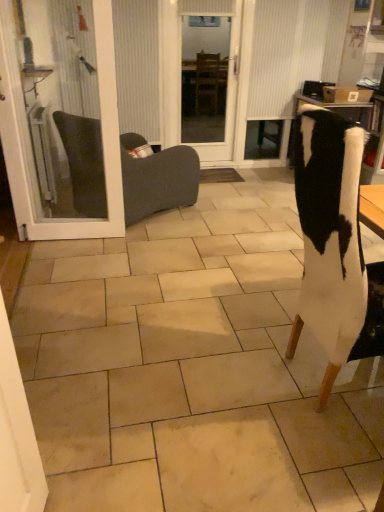
Describe the element at coordinates (275, 58) in the screenshot. I see `white textured curtain at upper center` at that location.

At what (x,y) coordinates should I click in order to perform the action: click on white textured curtain at upper center. Please return your answer as a coordinate pair (x, y). Looking at the image, I should click on (275, 58).

Can you confirm if white textured curtain at upper center is bigger than transparent glass door at center?

Yes.

Visually, is white textured curtain at upper center positioned to the left or to the right of transparent glass door at center?

white textured curtain at upper center is to the right of transparent glass door at center.

Is transparent glass door at center at the back of white textured curtain at upper center?

No, white textured curtain at upper center's orientation is not away from transparent glass door at center.

Is point (253, 86) in front of point (236, 17)?

No.

Are dark gray fabric chair at left, acting as the 1th chair starting from the left, and white textured curtain at upper center located far from each other?

That's right, there is a large distance between dark gray fabric chair at left, acting as the 1th chair starting from the left, and white textured curtain at upper center.

From the image's perspective, would you say dark gray fabric chair at left, which is the second chair in front-to-back order, is positioned over white textured curtain at upper center?

No, from the image's perspective, dark gray fabric chair at left, which is the second chair in front-to-back order, is not above white textured curtain at upper center.

From a real-world perspective, count 2nd chairs downward from the white textured curtain at upper center and point to it. Please provide its 2D coordinates.

[(157, 179)]

Based on their sizes in the image, would you say dark gray fabric chair at left, which is the second chair in front-to-back order, is bigger or smaller than white textured curtain at upper center?

In the image, dark gray fabric chair at left, which is the second chair in front-to-back order, appears to be larger than white textured curtain at upper center.

Is white fur chair at right, which is the second chair from back to front, facing towards white glass door at left?

No, white fur chair at right, which is the second chair from back to front, is not aimed at white glass door at left.

Is white fur chair at right, placed as the first chair when sorted from right to left, not near white glass door at left?

Yes, white fur chair at right, placed as the first chair when sorted from right to left, and white glass door at left are located far from each other.

Can you tell me how much white fur chair at right, placed as the second chair when sorted from left to right, and white glass door at left differ in facing direction?

The angle between the facing direction of white fur chair at right, placed as the second chair when sorted from left to right, and the facing direction of white glass door at left is 94.1 degrees.

From their relative heights in the image, would you say white fur chair at right, which is the second chair from back to front, is taller or shorter than white glass door at left?

white fur chair at right, which is the second chair from back to front, is shorter than white glass door at left.

From the image's perspective, is white textured curtain at upper center located beneath white fur chair at right, which is the second chair from back to front?

No, from the image's perspective, white textured curtain at upper center is not beneath white fur chair at right, which is the second chair from back to front.

Is white textured curtain at upper center positioned in front of white fur chair at right, which is counted as the first chair, starting from the front?

No, white textured curtain at upper center is further to the viewer.

Is white textured curtain at upper center positioned beyond the bounds of white fur chair at right, placed as the second chair when sorted from left to right?

Absolutely, white textured curtain at upper center is external to white fur chair at right, placed as the second chair when sorted from left to right.

How different are the orientations of white textured curtain at upper center and white fur chair at right, placed as the first chair when sorted from right to left, in degrees?

The facing directions of white textured curtain at upper center and white fur chair at right, placed as the first chair when sorted from right to left, are 89.4 degrees apart.

From the image's perspective, relative to dark gray fabric chair at left, which is the 1th chair in back-to-front order, is transparent glass door at center above or below?

Clearly, from the image's perspective, transparent glass door at center is above dark gray fabric chair at left, which is the 1th chair in back-to-front order.

From their relative heights in the image, would you say transparent glass door at center is taller or shorter than dark gray fabric chair at left, acting as the 1th chair starting from the left?

In the image, transparent glass door at center appears to be taller than dark gray fabric chair at left, acting as the 1th chair starting from the left.

I want to click on screen door above the dark gray fabric chair at left, acting as the 1th chair starting from the left (from the image's perspective), so click(x=226, y=102).

How different are the orientations of white fur chair at right, placed as the first chair when sorted from right to left, and white textured curtain at upper center in degrees?

The facing directions of white fur chair at right, placed as the first chair when sorted from right to left, and white textured curtain at upper center are 89.4 degrees apart.

Is white fur chair at right, which is the second chair from back to front, positioned with its back to white textured curtain at upper center?

No, white textured curtain at upper center is not at the back of white fur chair at right, which is the second chair from back to front.

From a real-world perspective, between white fur chair at right, placed as the first chair when sorted from right to left, and white textured curtain at upper center, who is vertically higher?

white textured curtain at upper center is physically above.

From the picture: Can you confirm if white fur chair at right, which is counted as the first chair, starting from the front, is taller than white textured curtain at upper center?

Incorrect, the height of white fur chair at right, which is counted as the first chair, starting from the front, is not larger of that of white textured curtain at upper center.

Which is behind, point (73, 167) or point (356, 332)?

The point (73, 167) is behind.

Between dark gray fabric chair at left, which ranks as the 2th chair in right-to-left order, and white fur chair at right, placed as the second chair when sorted from left to right, which one has larger size?

With larger size is dark gray fabric chair at left, which ranks as the 2th chair in right-to-left order.

In terms of height, does dark gray fabric chair at left, which ranks as the 2th chair in right-to-left order, look taller or shorter compared to white fur chair at right, placed as the first chair when sorted from right to left?

Clearly, dark gray fabric chair at left, which ranks as the 2th chair in right-to-left order, is shorter compared to white fur chair at right, placed as the first chair when sorted from right to left.

The image size is (384, 512). Find the location of `curtain located above the transparent glass door at center (from the image's perspective)`. curtain located above the transparent glass door at center (from the image's perspective) is located at coordinates (275, 58).

From a real-world perspective, starting from the white textured curtain at upper center, which chair is the 2nd one below it? Please provide its 2D coordinates.

[(157, 179)]

Looking at the image, which one is located further to dark gray fabric chair at left, which ranks as the 2th chair in right-to-left order, white textured curtain at upper center or transparent glass door at center?

white textured curtain at upper center lies further to dark gray fabric chair at left, which ranks as the 2th chair in right-to-left order, than the other object.

Based on their spatial positions, is white glass door at left or white fur chair at right, which is counted as the first chair, starting from the front, further from white textured curtain at upper center?

The object further to white textured curtain at upper center is white fur chair at right, which is counted as the first chair, starting from the front.

Which object lies further to the anchor point dark gray fabric chair at left, which is the second chair in front-to-back order, white textured curtain at upper center or white glass door at left?

white textured curtain at upper center lies further to dark gray fabric chair at left, which is the second chair in front-to-back order, than the other object.

Considering their positions, is white fur chair at right, placed as the first chair when sorted from right to left, positioned closer to white textured curtain at upper center than white glass door at left?

white glass door at left is positioned closer to the anchor white textured curtain at upper center.

Looking at the image, which one is located further to white fur chair at right, which is counted as the first chair, starting from the front, transparent glass door at center or dark gray fabric chair at left, which is the 1th chair in back-to-front order?

transparent glass door at center.

Based on their spatial positions, is white textured curtain at upper center or transparent glass door at center further from white fur chair at right, placed as the first chair when sorted from right to left?

transparent glass door at center lies further to white fur chair at right, placed as the first chair when sorted from right to left, than the other object.

From the image, which object appears to be nearer to white glass door at left, dark gray fabric chair at left, which is the 1th chair in back-to-front order, or white textured curtain at upper center?

dark gray fabric chair at left, which is the 1th chair in back-to-front order, is positioned closer to the anchor white glass door at left.

From the image, which object appears to be nearer to dark gray fabric chair at left, which is the 1th chair in back-to-front order, white glass door at left or white textured curtain at upper center?

white glass door at left is closer to dark gray fabric chair at left, which is the 1th chair in back-to-front order.

Where is `screen door between dark gray fabric chair at left, which ranks as the 2th chair in right-to-left order, and white textured curtain at upper center, in the horizontal direction`? screen door between dark gray fabric chair at left, which ranks as the 2th chair in right-to-left order, and white textured curtain at upper center, in the horizontal direction is located at coordinates (226, 102).

Where is `door located between white fur chair at right, which is the second chair from back to front, and dark gray fabric chair at left, which ranks as the 2th chair in right-to-left order, in the depth direction`? door located between white fur chair at right, which is the second chair from back to front, and dark gray fabric chair at left, which ranks as the 2th chair in right-to-left order, in the depth direction is located at coordinates (102, 138).

You are a GUI agent. You are given a task and a screenshot of the screen. Output one action in this format:
    pyautogui.click(x=<x>, y=<y>)
    Task: Click on the door positioned between white fur chair at right, which is counted as the first chair, starting from the front, and transparent glass door at center from near to far
    The width and height of the screenshot is (384, 512).
    Given the screenshot: What is the action you would take?
    pyautogui.click(x=102, y=138)

Locate an element on the screen. Image resolution: width=384 pixels, height=512 pixels. screen door between white fur chair at right, placed as the second chair when sorted from left to right, and white textured curtain at upper center, along the z-axis is located at coordinates (226, 102).